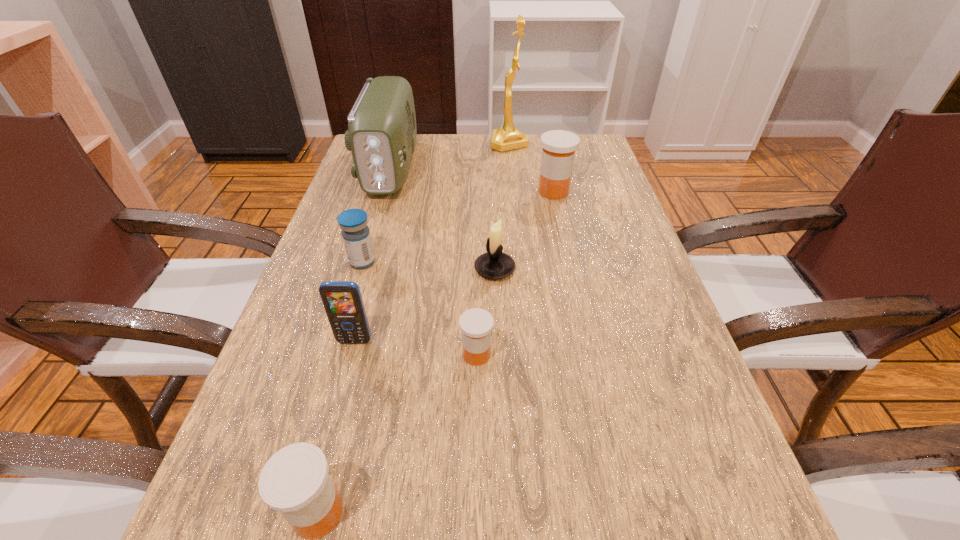
This screenshot has width=960, height=540. I want to click on the closest medicine to the candle holder, so click(476, 324).

Choose which medicine is the fourth nearest neighbor to the seventh shortest object. Please provide its 2D coordinates. Your answer should be formatted as a tuple, i.e. [(x, y)], where the tuple contains the x and y coordinates of a point satisfying the conditions above.

[(295, 481)]

Locate which orange medicine ranks third in proximity to the second tallest object. Please provide its 2D coordinates. Your answer should be formatted as a tuple, i.e. [(x, y)], where the tuple contains the x and y coordinates of a point satisfying the conditions above.

[(295, 481)]

Select which orange medicine appears as the second closest to the candle holder. Please provide its 2D coordinates. Your answer should be formatted as a tuple, i.e. [(x, y)], where the tuple contains the x and y coordinates of a point satisfying the conditions above.

[(558, 146)]

Where is `free point that satisfies the following two spatial constraints: 1. on the front-facing side of the tallest object; 2. on the front-facing side of the second tallest object`? free point that satisfies the following two spatial constraints: 1. on the front-facing side of the tallest object; 2. on the front-facing side of the second tallest object is located at coordinates (512, 168).